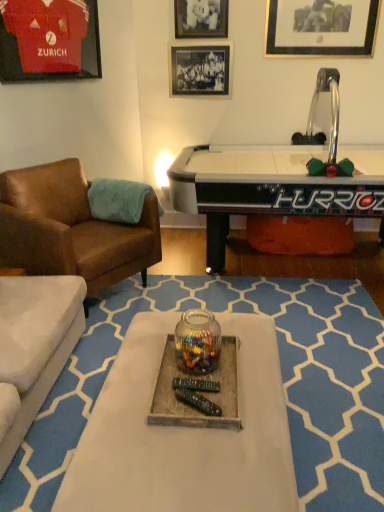
At what (x,y) coordinates should I click in order to perform the action: click on unoccupied area behind black plastic remote control at center, which is counted as the 2th remote control, starting from the front. Please return your answer as a coordinate pair (x, y). Looking at the image, I should click on (188, 368).